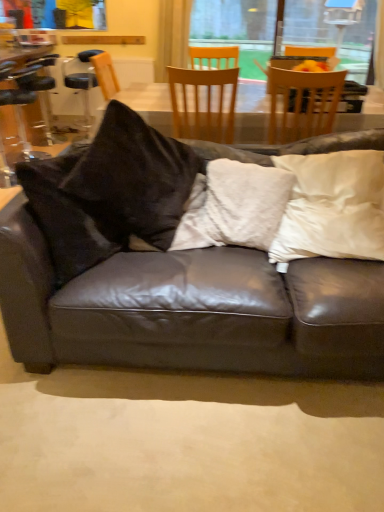
Question: Visually, is wooden chair at upper center, the first chair positioned from the right, positioned to the left or to the right of white fuzzy pillow at center, which appears as the second pillow when viewed from the right?

Choices:
 (A) left
 (B) right

Answer: (B)

Question: From the image's perspective, relative to white fuzzy pillow at center, which is the first pillow in left-to-right order, is wooden chair at upper center, the 3th chair positioned from the left, above or below?

Choices:
 (A) below
 (B) above

Answer: (B)

Question: Considering the real-world distances, which object is farthest from the white satin pillow at upper right, the 2th pillow positioned from the left?

Choices:
 (A) wooden chair at center, which is the 2th chair from left to right
 (B) black leather bar stool at left, which is the 1th chair in left-to-right order
 (C) wooden chair at upper center, the 3th chair positioned from the left
 (D) matte black leather couch at center
 (E) white fuzzy pillow at center, which is the first pillow in left-to-right order

Answer: (B)

Question: Considering the real-world distances, which object is farthest from the wooden chair at upper center, the 3th chair positioned from the left?

Choices:
 (A) white fuzzy pillow at center, which is the first pillow in left-to-right order
 (B) black leather bar stool at left, which is the 1th chair in left-to-right order
 (C) wooden chair at center, which is the 2th chair from left to right
 (D) matte black leather couch at center
 (E) clear plastic bar stool at left

Answer: (E)